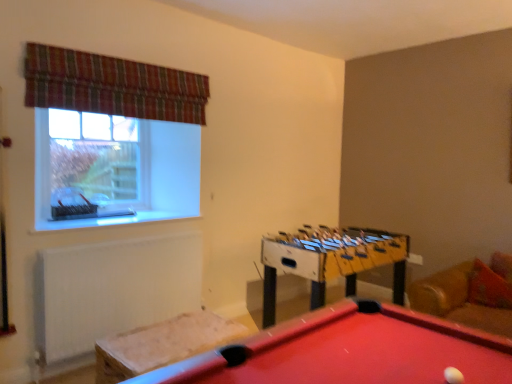
Describe the element at coordinates (350, 351) in the screenshot. This screenshot has width=512, height=384. I see `rubberized red pool table at lower center` at that location.

The height and width of the screenshot is (384, 512). Describe the element at coordinates (453, 376) in the screenshot. I see `white matte ball at lower right` at that location.

Image resolution: width=512 pixels, height=384 pixels. I want to click on white matte ball at lower right, so click(453, 376).

Describe the element at coordinates (97, 164) in the screenshot. This screenshot has width=512, height=384. I see `clear glass window at upper left` at that location.

The image size is (512, 384). Describe the element at coordinates (163, 344) in the screenshot. I see `velvet-like beige cushion at lower left` at that location.

Describe the element at coordinates (331, 260) in the screenshot. I see `yellow plastic foosball table at center` at that location.

Locate an element on the screen. The image size is (512, 384). matte plastic window sill at upper left is located at coordinates (111, 220).

Where is `rubberized red pool table at lower center`? Image resolution: width=512 pixels, height=384 pixels. rubberized red pool table at lower center is located at coordinates (350, 351).

Does velvet-like beige cushion at lower left come in front of yellow plastic foosball table at center?

That is True.

Considering the sizes of objects velvet-like beige cushion at lower left and yellow plastic foosball table at center in the image provided, who is bigger, velvet-like beige cushion at lower left or yellow plastic foosball table at center?

yellow plastic foosball table at center is bigger.

Is velvet-like beige cushion at lower left not within yellow plastic foosball table at center?

That's correct, velvet-like beige cushion at lower left is outside of yellow plastic foosball table at center.

Considering the sizes of rubberized red pool table at lower center and white matte ball at lower right in the image, is rubberized red pool table at lower center taller or shorter than white matte ball at lower right?

Considering their sizes, rubberized red pool table at lower center has more height than white matte ball at lower right.

From a real-world perspective, is rubberized red pool table at lower center located beneath white matte ball at lower right?

Correct, in the physical world, rubberized red pool table at lower center is lower than white matte ball at lower right.

In the image, is rubberized red pool table at lower center on the left side or the right side of white matte ball at lower right?

Clearly, rubberized red pool table at lower center is on the left of white matte ball at lower right in the image.

Is rubberized red pool table at lower center turned away from white matte ball at lower right?

rubberized red pool table at lower center is not turned away from white matte ball at lower right.

Which object is positioned more to the right, velvet-like beige cushion at lower left or white matte radiator at lower left?

Positioned to the right is velvet-like beige cushion at lower left.

From the image's perspective, which one is positioned lower, velvet-like beige cushion at lower left or white matte radiator at lower left?

velvet-like beige cushion at lower left, from the image's perspective.

Where is `furniture on the right of white matte radiator at lower left`? This screenshot has width=512, height=384. furniture on the right of white matte radiator at lower left is located at coordinates (163, 344).

Is the surface of velvet-like beige cushion at lower left in direct contact with white matte radiator at lower left?

velvet-like beige cushion at lower left and white matte radiator at lower left are not in contact.

Which of these two, matte plastic window sill at upper left or rubberized red pool table at lower center, is bigger?

rubberized red pool table at lower center.

From a real-world perspective, does matte plastic window sill at upper left sit lower than rubberized red pool table at lower center?

No, from a real-world perspective, matte plastic window sill at upper left is not below rubberized red pool table at lower center.

Is matte plastic window sill at upper left beside rubberized red pool table at lower center?

matte plastic window sill at upper left and rubberized red pool table at lower center are not in contact.

Considering the relative sizes of matte plastic window sill at upper left and rubberized red pool table at lower center in the image provided, is matte plastic window sill at upper left thinner than rubberized red pool table at lower center?

Correct, the width of matte plastic window sill at upper left is less than that of rubberized red pool table at lower center.

Which is behind, point (167, 219) or point (188, 85)?

Point (188, 85)

Would you say matte plastic window sill at upper left is outside plaid fabric curtain at upper left?

matte plastic window sill at upper left lies outside plaid fabric curtain at upper left's area.

Between matte plastic window sill at upper left and plaid fabric curtain at upper left, which one has smaller size?

Smaller between the two is matte plastic window sill at upper left.

Is matte plastic window sill at upper left taller or shorter than plaid fabric curtain at upper left?

Considering their sizes, matte plastic window sill at upper left has less height than plaid fabric curtain at upper left.

Is white matte ball at lower right taller than rubberized red pool table at lower center?

No, white matte ball at lower right is not taller than rubberized red pool table at lower center.

Is white matte ball at lower right oriented away from rubberized red pool table at lower center?

Yes, white matte ball at lower right's orientation is away from rubberized red pool table at lower center.

From a real-world perspective, who is located lower, white matte ball at lower right or rubberized red pool table at lower center?

rubberized red pool table at lower center is physically lower.

From the image's perspective, who appears lower, white matte ball at lower right or rubberized red pool table at lower center?

From the image's view, rubberized red pool table at lower center is below.

Between point (377, 233) and point (201, 312), which one is positioned behind?

Point (377, 233)

From the picture: Is yellow plastic foosball table at center oriented away from velvet-like beige cushion at lower left?

No, yellow plastic foosball table at center is not facing away from velvet-like beige cushion at lower left.

From the picture: Would you say yellow plastic foosball table at center is a long distance from velvet-like beige cushion at lower left?

Absolutely, yellow plastic foosball table at center is distant from velvet-like beige cushion at lower left.

Find the location of a particular element. table on the right side of velvet-like beige cushion at lower left is located at coordinates pyautogui.click(x=331, y=260).

Where is `billiard table to the left of white matte ball at lower right`? The image size is (512, 384). billiard table to the left of white matte ball at lower right is located at coordinates (350, 351).

From the image, which object appears to be farther from white matte ball at lower right, rubberized red pool table at lower center or plaid fabric curtain at upper left?

plaid fabric curtain at upper left lies further to white matte ball at lower right than the other object.

When comparing their distances from clear glass window at upper left, does yellow plastic foosball table at center or plaid fabric curtain at upper left seem further?

yellow plastic foosball table at center is further to clear glass window at upper left.

Based on their spatial positions, is rubberized red pool table at lower center or white matte ball at lower right further from plaid fabric curtain at upper left?

white matte ball at lower right is further to plaid fabric curtain at upper left.

Based on their spatial positions, is yellow plastic foosball table at center or white matte radiator at lower left further from white matte ball at lower right?

white matte radiator at lower left is further to white matte ball at lower right.

When comparing their distances from rubberized red pool table at lower center, does matte plastic window sill at upper left or white matte radiator at lower left seem closer?

white matte radiator at lower left.

Which object lies further to the anchor point velvet-like beige cushion at lower left, white matte radiator at lower left or rubberized red pool table at lower center?

rubberized red pool table at lower center is further to velvet-like beige cushion at lower left.

Based on their spatial positions, is white matte radiator at lower left or white matte ball at lower right further from yellow plastic foosball table at center?

white matte ball at lower right.

Considering their positions, is matte plastic window sill at upper left positioned further to plaid fabric curtain at upper left than yellow plastic foosball table at center?

yellow plastic foosball table at center.

Locate an element on the screen. The height and width of the screenshot is (384, 512). window sill between clear glass window at upper left and velvet-like beige cushion at lower left vertically is located at coordinates (111, 220).

Locate an element on the screen. Image resolution: width=512 pixels, height=384 pixels. radiator located between matte plastic window sill at upper left and yellow plastic foosball table at center in the left-right direction is located at coordinates (116, 289).

The image size is (512, 384). I want to click on curtain between matte plastic window sill at upper left and white matte ball at lower right in the horizontal direction, so click(112, 86).

This screenshot has height=384, width=512. Find the location of `window sill positioned between rubberized red pool table at lower center and yellow plastic foosball table at center from near to far`. window sill positioned between rubberized red pool table at lower center and yellow plastic foosball table at center from near to far is located at coordinates (111, 220).